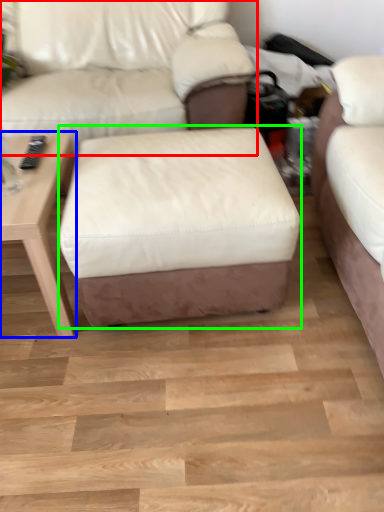
Question: Which is nearer to the studio couch (highlighted by a red box)? table (highlighted by a blue box) or stool (highlighted by a green box).

Choices:
 (A) table
 (B) stool

Answer: (A)